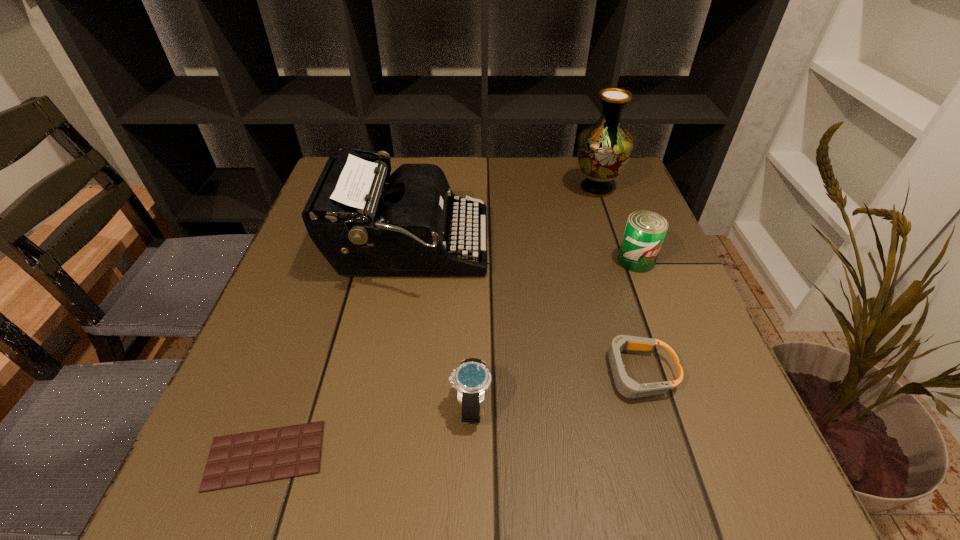
Where is `free space between the tallest object and the fourth shortest object`? This screenshot has width=960, height=540. free space between the tallest object and the fourth shortest object is located at coordinates (616, 224).

Find the location of a particular element. This screenshot has height=540, width=960. unoccupied area between the second shortest object and the fifth shortest object is located at coordinates (523, 310).

This screenshot has width=960, height=540. I want to click on vacant area that lies between the goggles and the chocolate bar, so click(451, 414).

At what (x,y) coordinates should I click in order to perform the action: click on vacant space that is in between the can and the goggles. Please return your answer as a coordinate pair (x, y). The width and height of the screenshot is (960, 540). Looking at the image, I should click on (636, 316).

At what (x,y) coordinates should I click in order to perform the action: click on vacant point located between the vase and the third tallest object. Please return your answer as a coordinate pair (x, y). The height and width of the screenshot is (540, 960). Looking at the image, I should click on (616, 224).

You are a GUI agent. You are given a task and a screenshot of the screen. Output one action in this format:
    pyautogui.click(x=<x>, y=<y>)
    Task: Click on the free spot between the tallest object and the can
    
    Given the screenshot: What is the action you would take?
    pyautogui.click(x=616, y=224)

Identify the location of unoccupied position between the chocolate bar and the typewriter. (338, 351).

Identify the location of free area in between the fourth tallest object and the second shortest object. (554, 389).

Where is `empty location between the watch and the fifth tallest object`? The width and height of the screenshot is (960, 540). empty location between the watch and the fifth tallest object is located at coordinates (554, 389).

This screenshot has width=960, height=540. I want to click on free space that is in between the chocolate bar and the fourth shortest object, so pos(450,358).